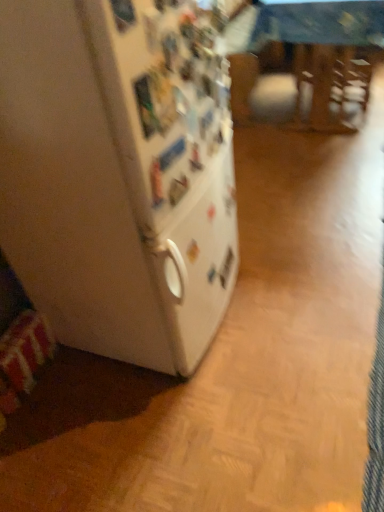
I want to click on free location in front of white matte refrigerator at left, so click(173, 426).